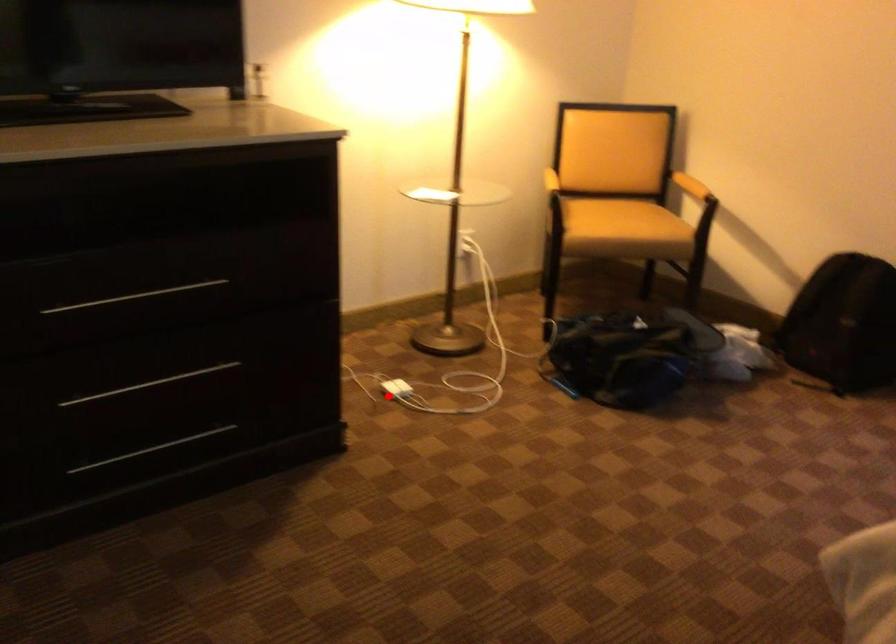
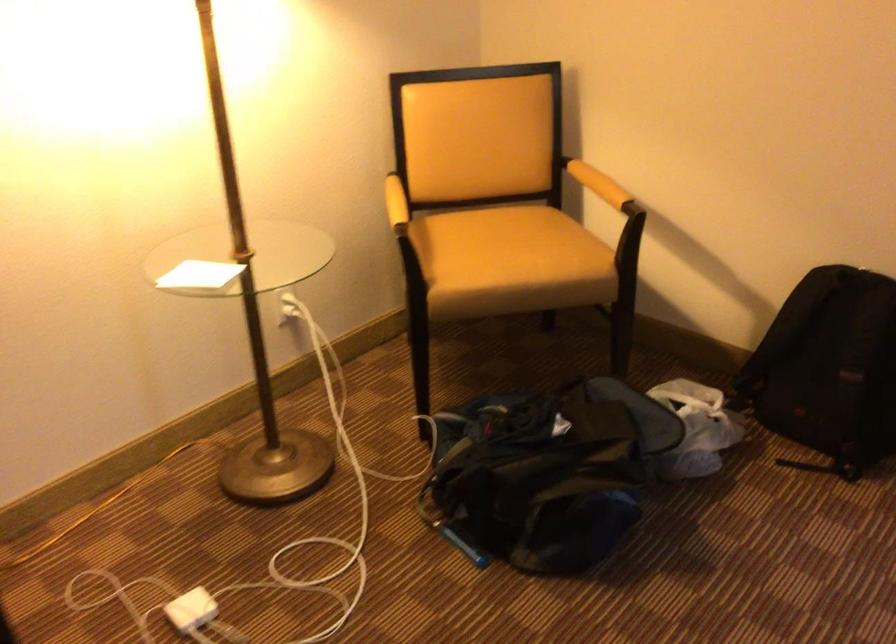
Question: A red point is marked in image1. In image2, is the corresponding 3D point closer to the camera or farther? Reply with the corresponding letter.

Choices:
 (A) The corresponding 3D point is closer.
 (B) The corresponding 3D point is farther.

Answer: (A)